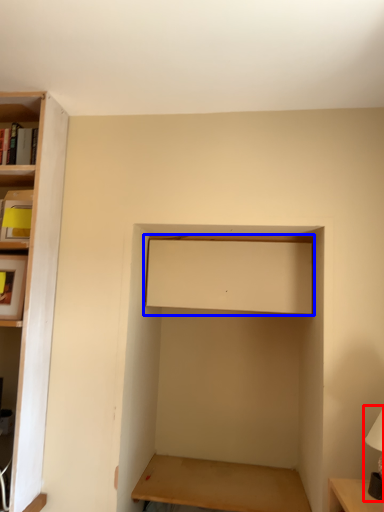
Question: Among these objects, which one is farthest to the camera, table lamp (highlighted by a red box) or cabinet (highlighted by a blue box)?

Choices:
 (A) table lamp
 (B) cabinet

Answer: (B)